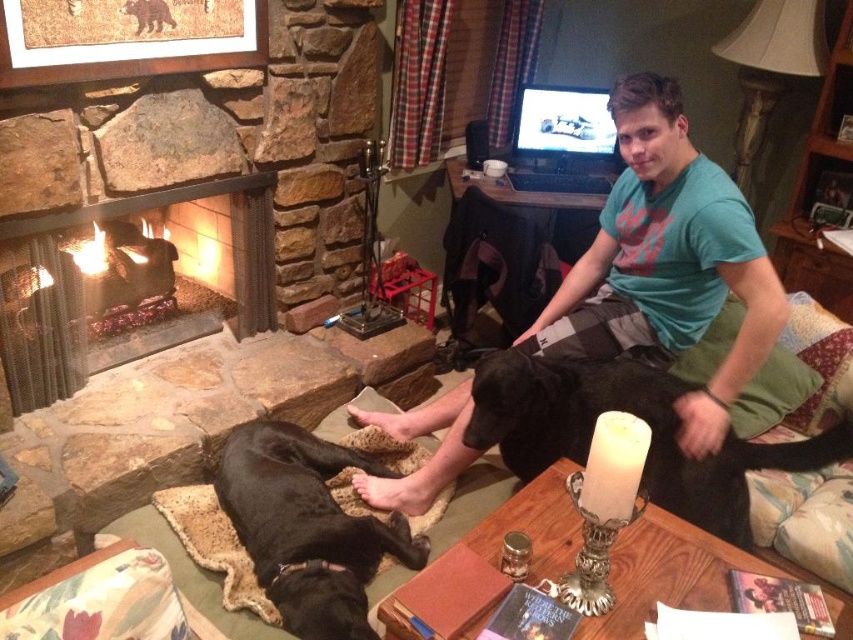
Looking at this image, you are a guest in this living room and want to pet the black fur dog at lower left. To reach it, you need to walk around the stone fireplace at left. Is the dog under the height of the fireplace?

The black fur dog at lower left is shorter than the stone fireplace at left, so yes, the dog is under the height of the fireplace.

From the picture: You are a guest in this living room and want to know if the black fur dog at lower left can comfortably lie down next to the stone fireplace at left. Considering their sizes, is there enough space?

The black fur dog at lower left is narrower than the stone fireplace at left, so there should be enough space for the dog to lie down comfortably next to it.